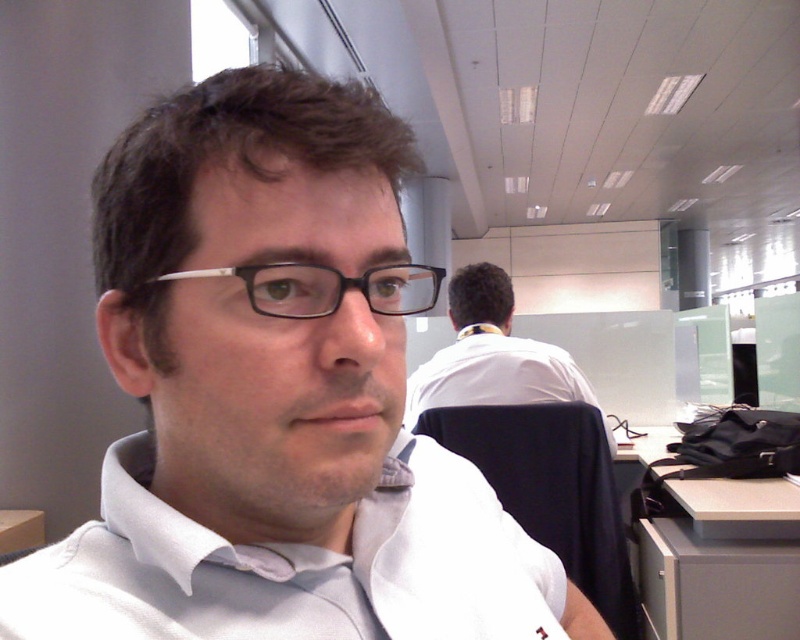
Does point (560, 564) come in front of point (418, 365)?

Yes, it is in front of point (418, 365).

Is white cotton dress shirt at center smaller than white shirt at upper center?

Correct, white cotton dress shirt at center occupies less space than white shirt at upper center.

Is point (40, 621) farther from camera compared to point (532, 346)?

No, it is in front of (532, 346).

The width and height of the screenshot is (800, 640). What are the coordinates of `white cotton dress shirt at center` in the screenshot? It's located at (293, 566).

How distant is white matte shirt at center from white shirt at upper center?

A distance of 4.30 feet exists between white matte shirt at center and white shirt at upper center.

Is white matte shirt at center to the right of white shirt at upper center from the viewer's perspective?

In fact, white matte shirt at center is to the left of white shirt at upper center.

Which is behind, point (468, 628) or point (486, 353)?

The point (486, 353) is more distant.

Where is `white matte shirt at center`? This screenshot has width=800, height=640. white matte shirt at center is located at coordinates (276, 397).

You are a GUI agent. You are given a task and a screenshot of the screen. Output one action in this format:
    pyautogui.click(x=<x>, y=<y>)
    Task: Click on the white shirt at upper center
    
    Given the screenshot: What is the action you would take?
    pyautogui.click(x=490, y=355)